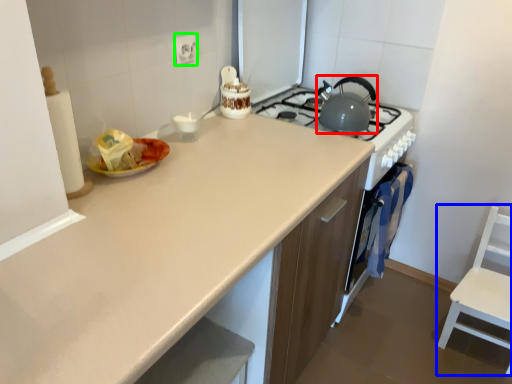
Question: Which is nearer to the kitchen appliance (highlighted by a red box)? chair (highlighted by a blue box) or electric outlet (highlighted by a green box).

Choices:
 (A) chair
 (B) electric outlet

Answer: (B)